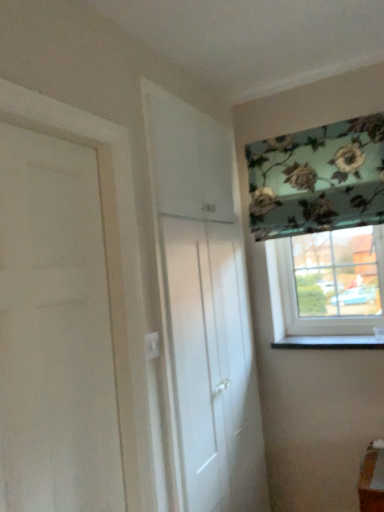
What is the approximate height of white glossy cabinet at center, which is the second door from front to back?

It is 6.62 feet.

In order to click on black marble window sill at lower right in this screenshot , I will do `click(330, 342)`.

The width and height of the screenshot is (384, 512). I want to click on white glossy cabinet at center, which ranks as the 1th door in right-to-left order, so click(x=203, y=311).

Can you confirm if white matte door at left, which is counted as the second door, starting from the back, is thinner than white glossy cabinet at center, positioned as the 1th door in back-to-front order?

No, white matte door at left, which is counted as the second door, starting from the back, is not thinner than white glossy cabinet at center, positioned as the 1th door in back-to-front order.

From a real-world perspective, who is located higher, white matte door at left, which is counted as the second door, starting from the back, or white glossy cabinet at center, positioned as the 1th door in back-to-front order?

white matte door at left, which is counted as the second door, starting from the back.

Could you measure the distance between white matte door at left, positioned as the first door in front-to-back order, and white glossy cabinet at center, which ranks as the 1th door in right-to-left order?

The distance of white matte door at left, positioned as the first door in front-to-back order, from white glossy cabinet at center, which ranks as the 1th door in right-to-left order, is 19.21 inches.

Is white glossy cabinet at center, positioned as the 1th door in back-to-front order, at the back of white matte door at left, which is counted as the second door, starting from the back?

No, white matte door at left, which is counted as the second door, starting from the back,'s orientation is not away from white glossy cabinet at center, positioned as the 1th door in back-to-front order.

Who is bigger, white glossy cabinet at center, marked as the 2th door in a left-to-right arrangement, or black marble window sill at lower right?

white glossy cabinet at center, marked as the 2th door in a left-to-right arrangement.

From the image's perspective, which one is positioned higher, white glossy cabinet at center, which ranks as the 1th door in right-to-left order, or black marble window sill at lower right?

white glossy cabinet at center, which ranks as the 1th door in right-to-left order, is shown above in the image.

Is point (174, 327) in front of point (317, 339)?

Yes, it is.

Is white glossy cabinet at center, which ranks as the 1th door in right-to-left order, thinner than black marble window sill at lower right?

Indeed, white glossy cabinet at center, which ranks as the 1th door in right-to-left order, has a lesser width compared to black marble window sill at lower right.

Between white glossy cabinet at center, marked as the 2th door in a left-to-right arrangement, and clear glass window at right, placed as the 1th window when sorted from bottom to top, which one has smaller size?

clear glass window at right, placed as the 1th window when sorted from bottom to top, is smaller.

Considering their positions, is white glossy cabinet at center, which ranks as the 1th door in right-to-left order, located in front of or behind clear glass window at right, placed as the 1th window when sorted from bottom to top?

white glossy cabinet at center, which ranks as the 1th door in right-to-left order, is positioned closer to the viewer than clear glass window at right, placed as the 1th window when sorted from bottom to top.

Considering the points (238, 416) and (348, 295), which point is behind, point (238, 416) or point (348, 295)?

The point (348, 295) is more distant.

Does white glossy cabinet at center, which is the second door from front to back, contain white matte door at left, which is counted as the second door, starting from the back?

Definitely not — white matte door at left, which is counted as the second door, starting from the back, is not inside white glossy cabinet at center, which is the second door from front to back.

Does white glossy cabinet at center, marked as the 2th door in a left-to-right arrangement, have a lesser height compared to white matte door at left, the first door when ordered from left to right?

In fact, white glossy cabinet at center, marked as the 2th door in a left-to-right arrangement, may be taller than white matte door at left, the first door when ordered from left to right.

How distant is white glossy cabinet at center, positioned as the 1th door in back-to-front order, from white matte door at left, positioned as the first door in front-to-back order?

white glossy cabinet at center, positioned as the 1th door in back-to-front order, and white matte door at left, positioned as the first door in front-to-back order, are 19.21 inches apart.

Between white matte door at left, which is counted as the second door, starting from the back, and floral fabric at upper right, positioned as the first window in top-to-bottom order, which one has more height?

white matte door at left, which is counted as the second door, starting from the back, is taller.

From the image's perspective, count 2nd windows upward from the white matte door at left, positioned as the first door in front-to-back order, and point to it. Please provide its 2D coordinates.

[(322, 232)]

Considering the sizes of objects white matte door at left, which is counted as the second door, starting from the back, and floral fabric at upper right, placed as the second window when sorted from bottom to top, in the image provided, who is smaller, white matte door at left, which is counted as the second door, starting from the back, or floral fabric at upper right, placed as the second window when sorted from bottom to top,?

white matte door at left, which is counted as the second door, starting from the back.

How much distance is there between white matte door at left, the first door when ordered from left to right, and floral fabric at upper right, placed as the second window when sorted from bottom to top?

A distance of 1.29 meters exists between white matte door at left, the first door when ordered from left to right, and floral fabric at upper right, placed as the second window when sorted from bottom to top.

Considering the relative positions of floral fabric at upper right, placed as the second window when sorted from bottom to top, and black marble window sill at lower right in the image provided, is floral fabric at upper right, placed as the second window when sorted from bottom to top, to the left of black marble window sill at lower right from the viewer's perspective?

Correct, you'll find floral fabric at upper right, placed as the second window when sorted from bottom to top, to the left of black marble window sill at lower right.

From the image's perspective, is floral fabric at upper right, positioned as the first window in top-to-bottom order, positioned above or below black marble window sill at lower right?

floral fabric at upper right, positioned as the first window in top-to-bottom order, is above black marble window sill at lower right.

Considering the sizes of floral fabric at upper right, positioned as the first window in top-to-bottom order, and black marble window sill at lower right in the image, is floral fabric at upper right, positioned as the first window in top-to-bottom order, wider or thinner than black marble window sill at lower right?

floral fabric at upper right, positioned as the first window in top-to-bottom order, is thinner than black marble window sill at lower right.

Who is bigger, floral fabric at upper right, placed as the second window when sorted from bottom to top, or black marble window sill at lower right?

floral fabric at upper right, placed as the second window when sorted from bottom to top, is bigger.

From a real-world perspective, is black marble window sill at lower right positioned over white glossy cabinet at center, which ranks as the 1th door in right-to-left order, based on gravity?

No, from a real-world perspective, black marble window sill at lower right is not on top of white glossy cabinet at center, which ranks as the 1th door in right-to-left order.

Locate an element on the screen. The width and height of the screenshot is (384, 512). window sill below the white glossy cabinet at center, which is the second door from front to back (from a real-world perspective) is located at coordinates (330, 342).

Are black marble window sill at lower right and white glossy cabinet at center, marked as the 2th door in a left-to-right arrangement, making contact?

No, black marble window sill at lower right is not making contact with white glossy cabinet at center, marked as the 2th door in a left-to-right arrangement.

Locate an element on the screen. Image resolution: width=384 pixels, height=512 pixels. door located above the white glossy cabinet at center, which ranks as the 1th door in right-to-left order (from the image's perspective) is located at coordinates (55, 332).

Starting from the black marble window sill at lower right, which door is the 1st one to the left? Please provide its 2D coordinates.

[(203, 311)]

Looking at the image, which one is located closer to clear glass window at right, the second window in the top-to-bottom sequence, black marble window sill at lower right or white matte door at left, acting as the 2th door starting from the right?

black marble window sill at lower right is positioned closer to the anchor clear glass window at right, the second window in the top-to-bottom sequence.

Estimate the real-world distances between objects in this image. Which object is further from clear glass window at right, the second window in the top-to-bottom sequence, white matte door at left, the first door when ordered from left to right, or floral fabric at upper right, positioned as the first window in top-to-bottom order?

white matte door at left, the first door when ordered from left to right.

Considering their positions, is floral fabric at upper right, placed as the second window when sorted from bottom to top, positioned further to clear glass window at right, placed as the 1th window when sorted from bottom to top, than white matte door at left, positioned as the first door in front-to-back order?

Among the two, white matte door at left, positioned as the first door in front-to-back order, is located further to clear glass window at right, placed as the 1th window when sorted from bottom to top.

Considering their positions, is floral fabric at upper right, positioned as the first window in top-to-bottom order, positioned closer to white matte door at left, which is counted as the second door, starting from the back, than clear glass window at right, the second window in the top-to-bottom sequence?

floral fabric at upper right, positioned as the first window in top-to-bottom order, is positioned closer to the anchor white matte door at left, which is counted as the second door, starting from the back.

Based on their spatial positions, is white glossy cabinet at center, marked as the 2th door in a left-to-right arrangement, or floral fabric at upper right, placed as the second window when sorted from bottom to top, closer to white matte door at left, positioned as the first door in front-to-back order?

The object closer to white matte door at left, positioned as the first door in front-to-back order, is white glossy cabinet at center, marked as the 2th door in a left-to-right arrangement.

From the image, which object appears to be nearer to black marble window sill at lower right, white matte door at left, the first door when ordered from left to right, or floral fabric at upper right, placed as the second window when sorted from bottom to top?

floral fabric at upper right, placed as the second window when sorted from bottom to top, is positioned closer to the anchor black marble window sill at lower right.

Considering their positions, is black marble window sill at lower right positioned further to white matte door at left, acting as the 2th door starting from the right, than white glossy cabinet at center, marked as the 2th door in a left-to-right arrangement?

black marble window sill at lower right is further to white matte door at left, acting as the 2th door starting from the right.

When comparing their distances from clear glass window at right, the second window in the top-to-bottom sequence, does white matte door at left, the first door when ordered from left to right, or white glossy cabinet at center, positioned as the 1th door in back-to-front order, seem closer?

white glossy cabinet at center, positioned as the 1th door in back-to-front order, is positioned closer to the anchor clear glass window at right, the second window in the top-to-bottom sequence.

In order to click on door situated between white matte door at left, acting as the 2th door starting from the right, and floral fabric at upper right, placed as the second window when sorted from bottom to top, from left to right in this screenshot , I will do `click(203, 311)`.

Locate an element on the screen. window sill between white glossy cabinet at center, positioned as the 1th door in back-to-front order, and clear glass window at right, placed as the 1th window when sorted from bottom to top, along the z-axis is located at coordinates (330, 342).

Where is `window between white matte door at left, positioned as the first door in front-to-back order, and black marble window sill at lower right`? This screenshot has height=512, width=384. window between white matte door at left, positioned as the first door in front-to-back order, and black marble window sill at lower right is located at coordinates (322, 232).

Locate an element on the screen. The height and width of the screenshot is (512, 384). window between white matte door at left, which is counted as the second door, starting from the back, and clear glass window at right, the second window in the top-to-bottom sequence, in the front-back direction is located at coordinates (322, 232).